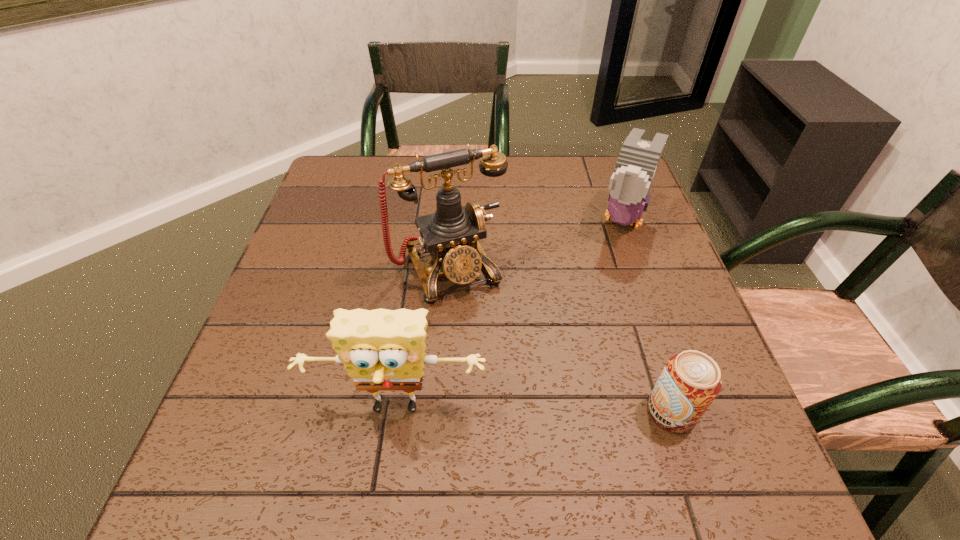
Where is `vacant area that lies between the beer can and the bird`? vacant area that lies between the beer can and the bird is located at coordinates (646, 315).

At what (x,y) coordinates should I click in order to perform the action: click on free space between the sponge and the bird. Please return your answer as a coordinate pair (x, y). This screenshot has height=540, width=960. Looking at the image, I should click on (509, 314).

Identify the location of unoccupied position between the shortest object and the sponge. (534, 410).

Locate an element on the screen. This screenshot has height=540, width=960. free spot between the sponge and the shortest object is located at coordinates (534, 410).

You are a GUI agent. You are given a task and a screenshot of the screen. Output one action in this format:
    pyautogui.click(x=<x>, y=<y>)
    Task: Click on the free spot between the bird and the sponge
    
    Given the screenshot: What is the action you would take?
    pyautogui.click(x=509, y=314)

This screenshot has height=540, width=960. In order to click on free spot between the shortest object and the tallest object in this screenshot , I will do [x=561, y=340].

I want to click on object that stands as the second closest to the beer can, so click(x=451, y=235).

Locate an element on the screen. This screenshot has height=540, width=960. object that ranks as the closest to the bird is located at coordinates (451, 235).

Locate an element on the screen. The image size is (960, 540). vacant point that satisfies the following two spatial constraints: 1. on the face of the sponge; 2. on the right side of the beer can is located at coordinates (396, 411).

Find the location of a particular element. vacant space that satisfies the following two spatial constraints: 1. on the face of the sponge; 2. on the right side of the shortest object is located at coordinates (396, 411).